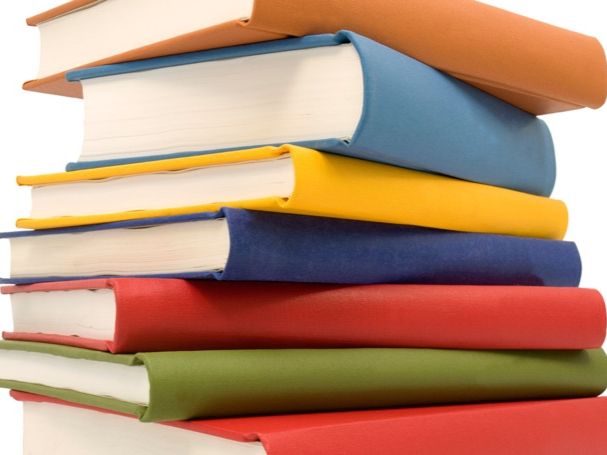
You are a GUI agent. You are given a task and a screenshot of the screen. Output one action in this format:
    pyautogui.click(x=<x>, y=<y>)
    Task: Click on the books
    This screenshot has width=607, height=455.
    Given the screenshot: What is the action you would take?
    pyautogui.click(x=177, y=17), pyautogui.click(x=215, y=107), pyautogui.click(x=189, y=193), pyautogui.click(x=175, y=258), pyautogui.click(x=110, y=314), pyautogui.click(x=119, y=371), pyautogui.click(x=180, y=446)